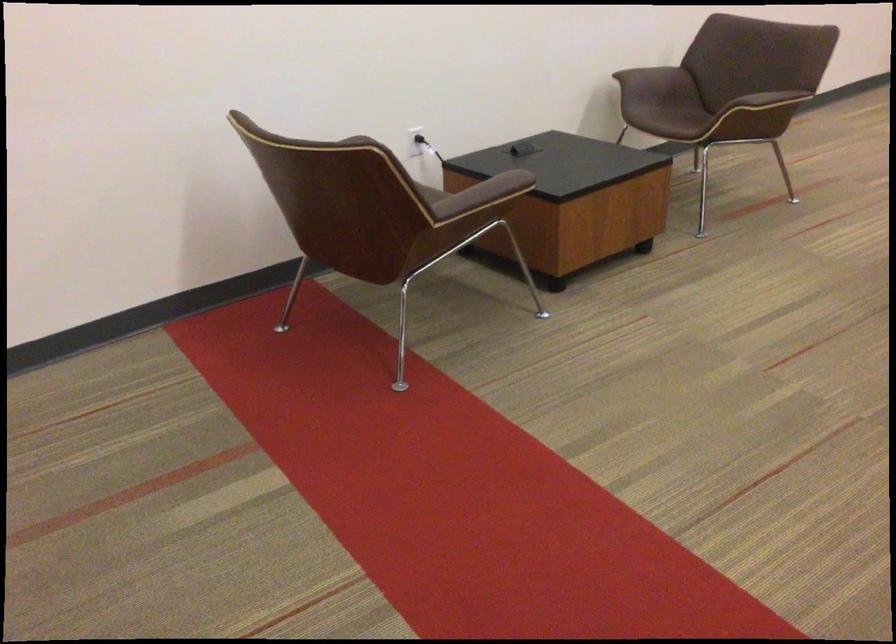
Find the location of `wall power outlet`. wall power outlet is located at coordinates (415, 140).